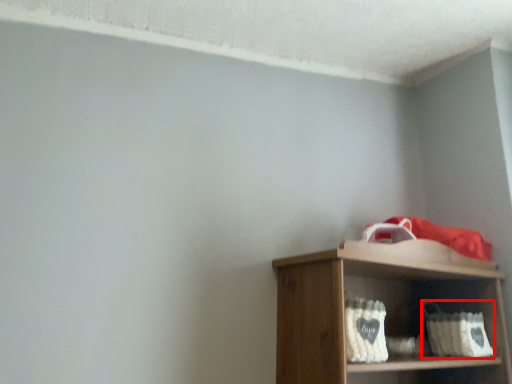
Question: Observing the image, what is the correct spatial positioning of basket (annotated by the red box) in reference to basket?

Choices:
 (A) left
 (B) right

Answer: (B)